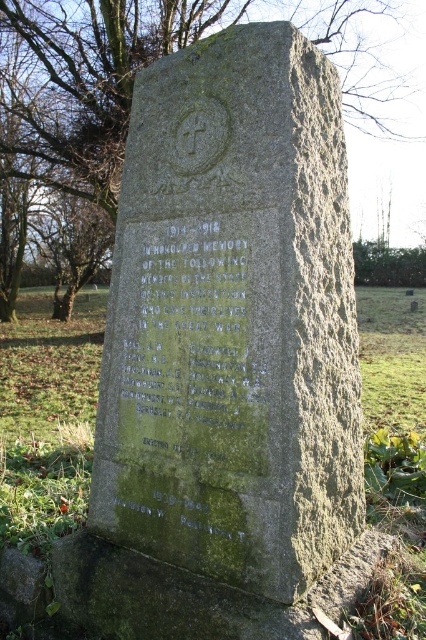
Question: Estimate the real-world distances between objects in this image. Which object is farther from the green mossy stone at upper left?

Choices:
 (A) green mossy stone at center
 (B) green stone gravestone at center

Answer: (B)

Question: Which of the following is the closest to the observer?

Choices:
 (A) (256, 289)
 (B) (23, 84)

Answer: (A)

Question: Observing the image, what is the correct spatial positioning of green mossy stone at center in reference to green mossy stone at upper left?

Choices:
 (A) left
 (B) right

Answer: (B)

Question: Does green stone gravestone at center have a greater width compared to green mossy stone at upper left?

Choices:
 (A) yes
 (B) no

Answer: (A)

Question: Does green stone gravestone at center have a lesser width compared to green mossy stone at upper left?

Choices:
 (A) no
 (B) yes

Answer: (A)

Question: Which is farther from the green stone gravestone at center?

Choices:
 (A) green mossy stone at center
 (B) green mossy stone at upper left

Answer: (B)